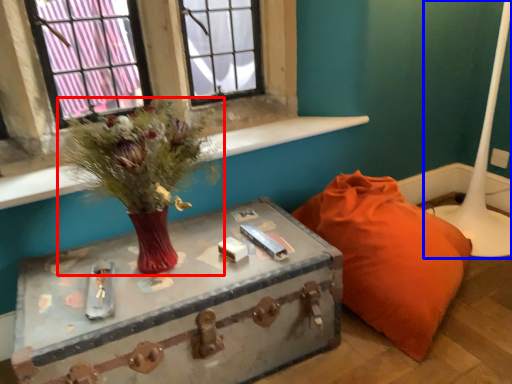
Question: Among these objects, which one is nearest to the camera, floral arrangement (highlighted by a red box) or table lamp (highlighted by a blue box)?

Choices:
 (A) floral arrangement
 (B) table lamp

Answer: (A)